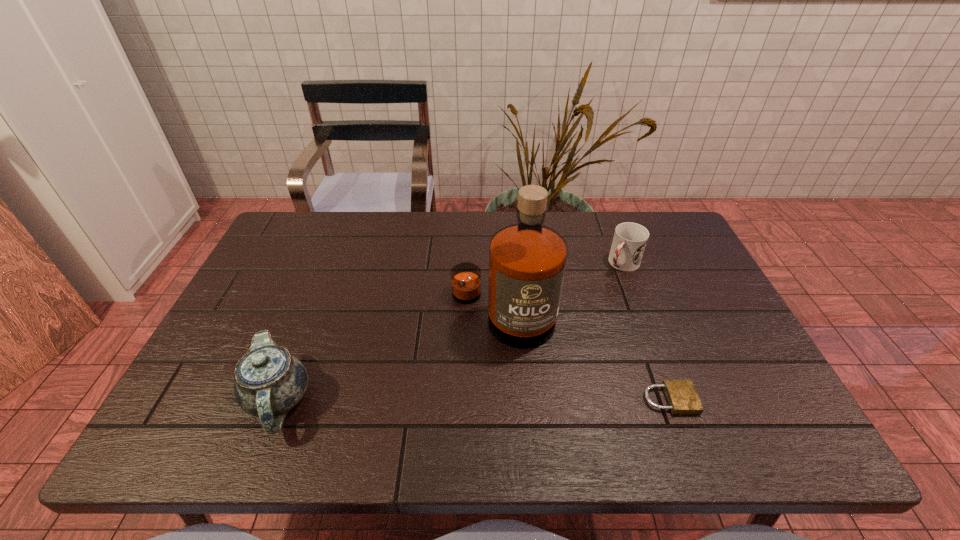
This screenshot has width=960, height=540. What are the coordinates of `vacant space located 0.090m on the side of the cup where the handle is located` in the screenshot? It's located at (600, 290).

Locate an element on the screen. vacant space located on the front label of the second farthest object is located at coordinates (432, 402).

Find the location of a particular element. This screenshot has height=540, width=960. free location located on the front label of the second farthest object is located at coordinates click(x=438, y=396).

This screenshot has width=960, height=540. Identify the location of free location located on the front label of the second farthest object. (444, 386).

The width and height of the screenshot is (960, 540). Find the location of `object that is at the far edge`. object that is at the far edge is located at coordinates (630, 239).

Locate an element on the screen. Image resolution: width=960 pixels, height=540 pixels. chinaware positioned at the near edge is located at coordinates (269, 381).

Where is `padlock at the near edge`? padlock at the near edge is located at coordinates (682, 397).

At what (x,y) coordinates should I click in order to perform the action: click on object at the left edge. Please return your answer as a coordinate pair (x, y). Looking at the image, I should click on (269, 381).

Find the location of a particular element. Image resolution: width=960 pixels, height=540 pixels. object positioned at the near left corner is located at coordinates (269, 381).

The image size is (960, 540). In order to click on blank area at the far edge in this screenshot , I will do `click(462, 237)`.